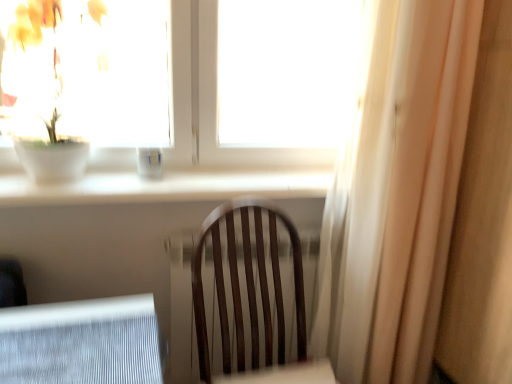
The height and width of the screenshot is (384, 512). In order to click on transparent glass window at upper center in this screenshot , I will do `click(210, 80)`.

Is white sheer curtain at right looking in the opposite direction of transparent glass window at upper center?

No, white sheer curtain at right's orientation is not away from transparent glass window at upper center.

Does white sheer curtain at right have a larger size compared to transparent glass window at upper center?

Yes, white sheer curtain at right is bigger than transparent glass window at upper center.

Between white sheer curtain at right and transparent glass window at upper center, which one is positioned behind?

Positioned behind is transparent glass window at upper center.

Is there a large distance between white sheer curtain at right and green matte plant at upper left?

white sheer curtain at right is far away from green matte plant at upper left.

Does white sheer curtain at right appear on the left side of green matte plant at upper left?

No.

Is white sheer curtain at right outside of green matte plant at upper left?

Yes, white sheer curtain at right is located beyond the bounds of green matte plant at upper left.

Can you confirm if white sheer curtain at right is thinner than green matte plant at upper left?

No.

Could you tell me if transparent glass window at upper center is turned towards white sheer curtain at right?

No.

Between transparent glass window at upper center and white sheer curtain at right, which one has larger width?

With larger width is white sheer curtain at right.

Is white sheer curtain at right completely or partially inside transparent glass window at upper center?

That's incorrect, white sheer curtain at right is not inside transparent glass window at upper center.

How different are the orientations of transparent glass window at upper center and white sheer curtain at right in degrees?

The angle between the facing direction of transparent glass window at upper center and the facing direction of white sheer curtain at right is 4.43 degrees.

Is point (46, 0) closer or farther from the camera than point (446, 170)?

Point (46, 0) appears to be closer to the viewer than point (446, 170).

Find the location of a particular element. curtain directly beneath the green matte plant at upper left (from a real-world perspective) is located at coordinates (422, 200).

Is green matte plant at upper left wider than white sheer curtain at right?

In fact, green matte plant at upper left might be narrower than white sheer curtain at right.

In the scene shown: Is green matte plant at upper left directly adjacent to white sheer curtain at right?

No, green matte plant at upper left is not touching white sheer curtain at right.

Would you say green matte plant at upper left is a long distance from transparent glass window at upper center?

No, green matte plant at upper left is in close proximity to transparent glass window at upper center.

Image resolution: width=512 pixels, height=384 pixels. I want to click on houseplant in front of the transparent glass window at upper center, so click(x=39, y=43).

From a real-world perspective, between green matte plant at upper left and transparent glass window at upper center, who is vertically higher?

In real-world perspective, transparent glass window at upper center is above.

From the image's perspective, is green matte plant at upper left on transparent glass window at upper center?

No, from the image's perspective, green matte plant at upper left is not over transparent glass window at upper center.

Could you tell me if transparent glass window at upper center is turned towards green matte plant at upper left?

Yes, transparent glass window at upper center faces towards green matte plant at upper left.

Would you say transparent glass window at upper center is to the left or to the right of green matte plant at upper left in the picture?

From the image, it's evident that transparent glass window at upper center is to the right of green matte plant at upper left.

How many degrees apart are the facing directions of transparent glass window at upper center and green matte plant at upper left?

The angular difference between transparent glass window at upper center and green matte plant at upper left is 1.15 degrees.

In the image, there is a transparent glass window at upper center. At what (x,y) coordinates should I click in order to perform the action: click on houseplant below it (from the image's perspective). Please return your answer as a coordinate pair (x, y). The image size is (512, 384). Looking at the image, I should click on (39, 43).

You are a GUI agent. You are given a task and a screenshot of the screen. Output one action in this format:
    pyautogui.click(x=<x>, y=<y>)
    Task: Click on the curtain on the right of transparent glass window at upper center
    This screenshot has width=512, height=384.
    Given the screenshot: What is the action you would take?
    pyautogui.click(x=422, y=200)

In the image, there is a white sheer curtain at right. Where is `houseplant above it (from the image's perspective)`? This screenshot has width=512, height=384. houseplant above it (from the image's perspective) is located at coordinates (39, 43).

Estimate the real-world distances between objects in this image. Which object is closer to white sheer curtain at right, green matte plant at upper left or transparent glass window at upper center?

transparent glass window at upper center is closer to white sheer curtain at right.

Based on the photo, considering their positions, is transparent glass window at upper center positioned further to green matte plant at upper left than white sheer curtain at right?

The object further to green matte plant at upper left is white sheer curtain at right.

Looking at the image, which one is located closer to white sheer curtain at right, transparent glass window at upper center or green matte plant at upper left?

transparent glass window at upper center is positioned closer to the anchor white sheer curtain at right.

Estimate the real-world distances between objects in this image. Which object is further from green matte plant at upper left, white sheer curtain at right or transparent glass window at upper center?

white sheer curtain at right is further to green matte plant at upper left.

Estimate the real-world distances between objects in this image. Which object is further from transparent glass window at upper center, white sheer curtain at right or green matte plant at upper left?

Based on the image, white sheer curtain at right appears to be further to transparent glass window at upper center.

Estimate the real-world distances between objects in this image. Which object is closer to transparent glass window at upper center, green matte plant at upper left or white sheer curtain at right?

The object closer to transparent glass window at upper center is green matte plant at upper left.

Find the location of a particular element. window between green matte plant at upper left and white sheer curtain at right in the horizontal direction is located at coordinates (210, 80).